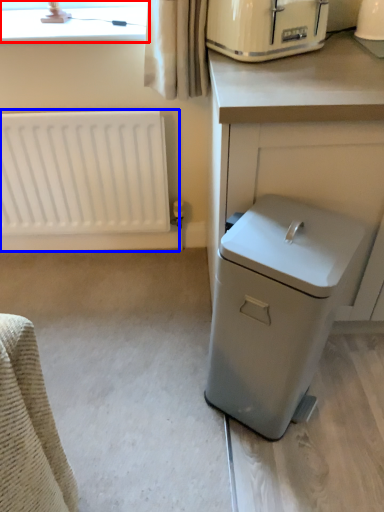
Question: Which object is further to the camera taking this photo, bay window (highlighted by a red box) or radiator (highlighted by a blue box)?

Choices:
 (A) bay window
 (B) radiator

Answer: (B)